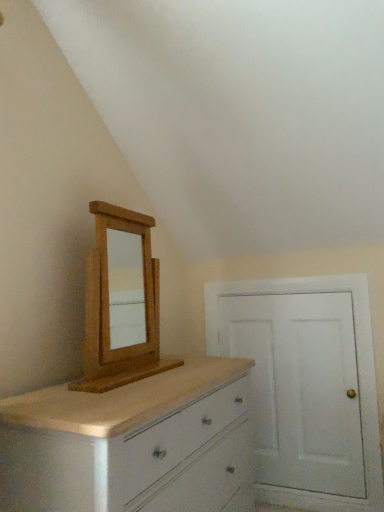
Question: Does point (180, 460) appear closer or farther from the camera than point (289, 458)?

Choices:
 (A) farther
 (B) closer

Answer: (B)

Question: Based on their positions, is white painted wood chest of drawers at lower left located to the left or right of white painted wood door at right?

Choices:
 (A) right
 (B) left

Answer: (B)

Question: Considering the real-world distances, which object is closest to the white painted wood chest of drawers at lower left?

Choices:
 (A) light brown wood medicine cabinet at upper left
 (B) white painted wood door at right

Answer: (A)

Question: Which of these objects is positioned closest to the white painted wood chest of drawers at lower left?

Choices:
 (A) light brown wood medicine cabinet at upper left
 (B) white painted wood door at right

Answer: (A)